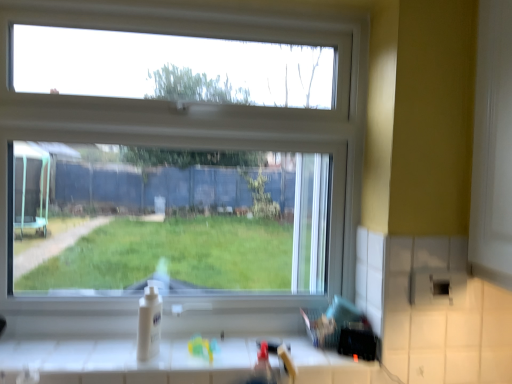
The height and width of the screenshot is (384, 512). Find the location of `vacant area on top of clear glass window at center (from a real-world perspective)`. vacant area on top of clear glass window at center (from a real-world perspective) is located at coordinates (214, 8).